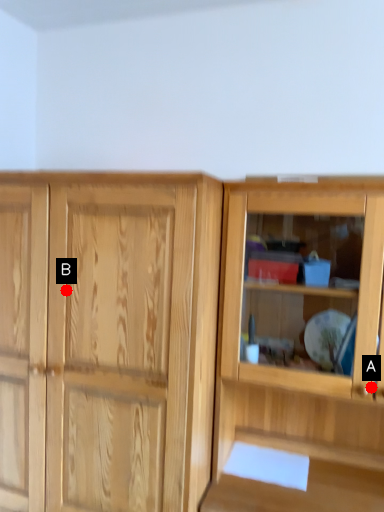
Question: Two points are circled on the image, labeled by A and B beside each circle. Which point is closer to the camera?

Choices:
 (A) A is closer
 (B) B is closer

Answer: (A)